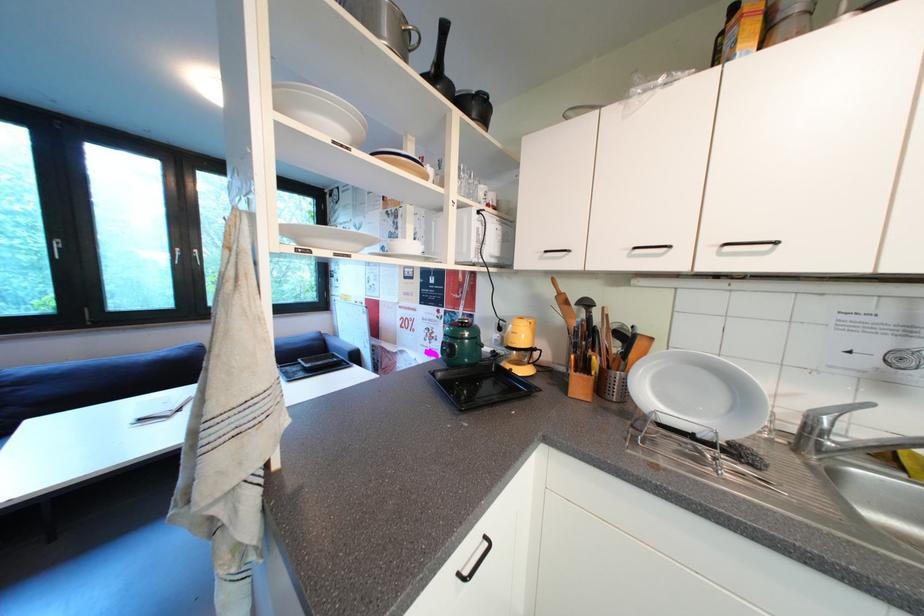
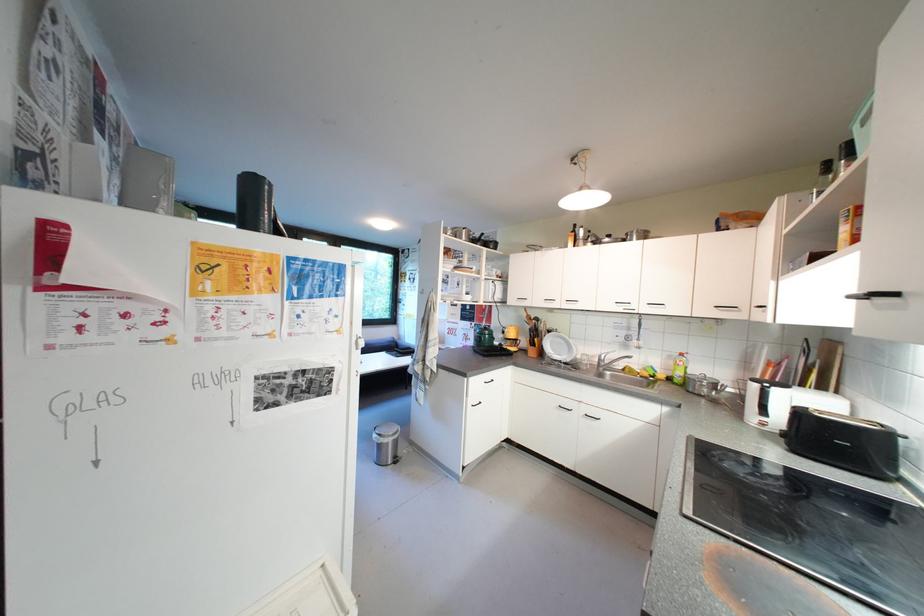
Where in the second image is the point corresponding to [513,267] from the first image?

(512, 304)